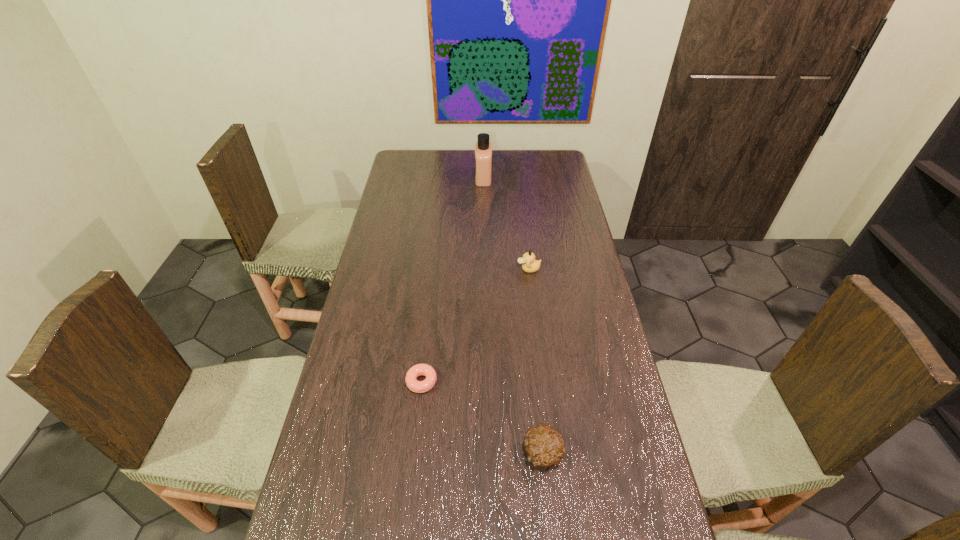
The image size is (960, 540). Identify the location of the farthest object. (483, 149).

Locate an element on the screen. The height and width of the screenshot is (540, 960). the tallest object is located at coordinates (483, 149).

Locate an element on the screen. This screenshot has width=960, height=540. duckling is located at coordinates (530, 265).

Find the location of a particular element. muffin is located at coordinates (544, 444).

Where is `the third tallest object`? The image size is (960, 540). the third tallest object is located at coordinates (544, 444).

Identify the location of the leftmost object. The height and width of the screenshot is (540, 960). (413, 384).

Where is `the shortest object`? the shortest object is located at coordinates (413, 384).

Identify the location of free space located on the front label of the perfume. tap(408, 178).

Locate an element on the screen. free spot located 0.160m on the front label of the perfume is located at coordinates (441, 178).

Locate an element on the screen. The height and width of the screenshot is (540, 960). free spot located 0.320m on the front label of the perfume is located at coordinates (406, 178).